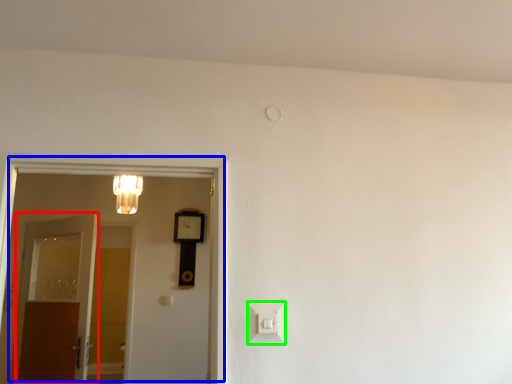
Question: Which object is the farthest from door (highlighted by a red box)? Choose among these: door (highlighted by a blue box) or light switch (highlighted by a green box).

Choices:
 (A) door
 (B) light switch

Answer: (B)